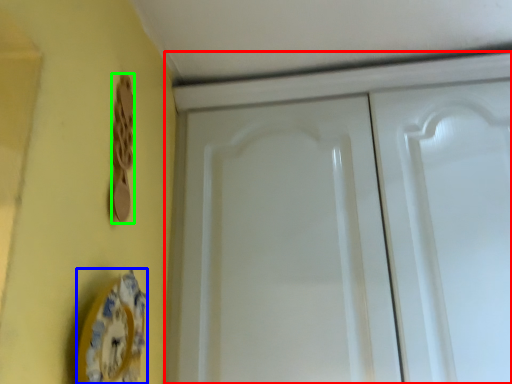
Question: Which is farther away from cabinetry (highlighted by a red box)? plate (highlighted by a blue box) or door handle (highlighted by a green box)?

Choices:
 (A) plate
 (B) door handle

Answer: (A)